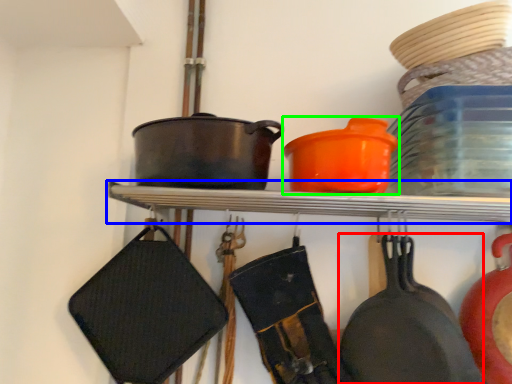
Question: Which object is positioned farthest from frying pan (highlighted by a red box)? Select from shelf (highlighted by a blue box) and tableware (highlighted by a green box).

Choices:
 (A) shelf
 (B) tableware

Answer: (B)